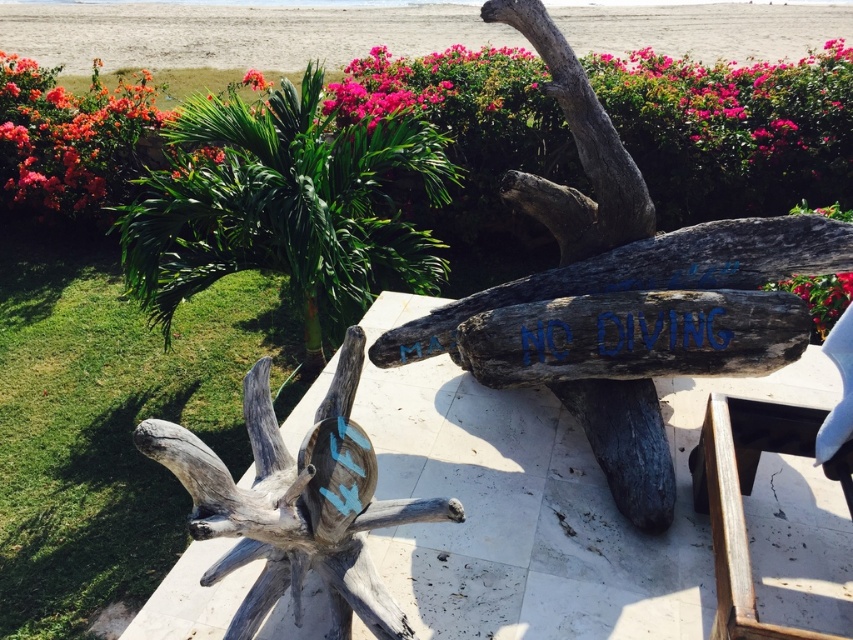
Question: Which object appears closest to the camera in this image?

Choices:
 (A) driftwood sculpture at center
 (B) beige sand at upper center
 (C) gray rough wood log at center
 (D) vivid pink petals at upper center

Answer: (A)

Question: Is vibrant coral petals at upper left wider than dark brown wood at upper center?

Choices:
 (A) no
 (B) yes

Answer: (B)

Question: Which of these objects is positioned farthest from the vibrant coral petals at upper left?

Choices:
 (A) vivid pink petals at upper right
 (B) driftwood sculpture at center
 (C) green leafy plant at upper left

Answer: (A)

Question: Where is dark brown wood at upper center located in relation to vivid pink petals at upper right in the image?

Choices:
 (A) left
 (B) right

Answer: (A)

Question: Which point appears closest to the camera in this image?

Choices:
 (A) (846, 275)
 (B) (253, 80)
 (C) (148, 13)
 (D) (560, 212)

Answer: (D)

Question: Can you confirm if vivid pink petals at upper right is positioned to the right of vivid pink petals at upper center?

Choices:
 (A) no
 (B) yes

Answer: (B)